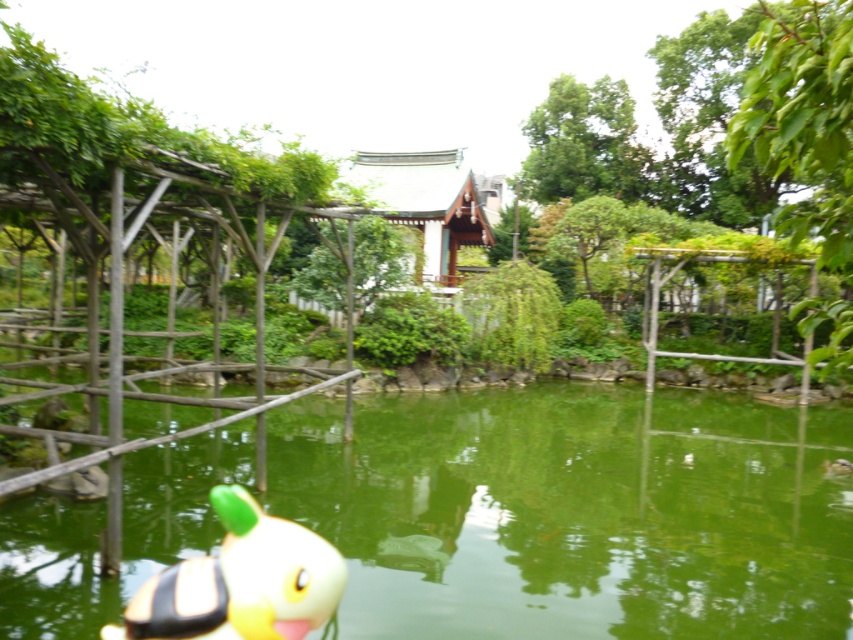
Does point (828, 624) come farther from viewer compared to point (207, 577)?

That is True.

In the scene shown: Can you confirm if green liquid water at center is positioned below yellow rubber duck at lower left?

Indeed, green liquid water at center is positioned under yellow rubber duck at lower left.

Measure the distance between point (543, 605) and camera.

5.68 meters

You are a GUI agent. You are given a task and a screenshot of the screen. Output one action in this format:
    pyautogui.click(x=<x>, y=<y>)
    Task: Click on the green liquid water at center
    
    Given the screenshot: What is the action you would take?
    pyautogui.click(x=573, y=512)